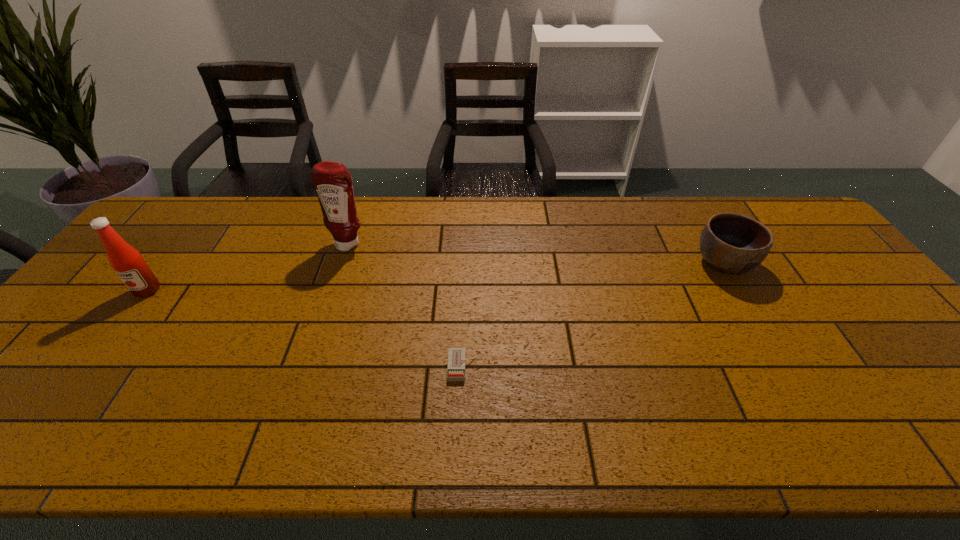
The image size is (960, 540). In order to click on free region located 0.070m on the right of the bowl in this screenshot , I will do `click(778, 263)`.

Locate an element on the screen. Image resolution: width=960 pixels, height=540 pixels. blank area located 0.320m on the striking surface of the shortest object is located at coordinates (612, 367).

This screenshot has width=960, height=540. Identify the location of object positioned at the far edge. (333, 183).

Identify the location of object that is at the left edge. This screenshot has width=960, height=540. (127, 262).

Locate an element on the screen. vacant space at the far edge of the desktop is located at coordinates (446, 214).

This screenshot has width=960, height=540. Find the location of `free space at the left edge`. free space at the left edge is located at coordinates (157, 262).

Where is `vacant space at the right edge`? vacant space at the right edge is located at coordinates (804, 251).

In the image, there is a desktop. Where is `free region at the far left corner`? This screenshot has height=540, width=960. free region at the far left corner is located at coordinates 185,227.

This screenshot has width=960, height=540. What are the coordinates of `empty location between the nearest object and the second tallest object` in the screenshot? It's located at (305, 328).

What are the coordinates of `free space between the matchbox and the left condiment` in the screenshot? It's located at (305, 328).